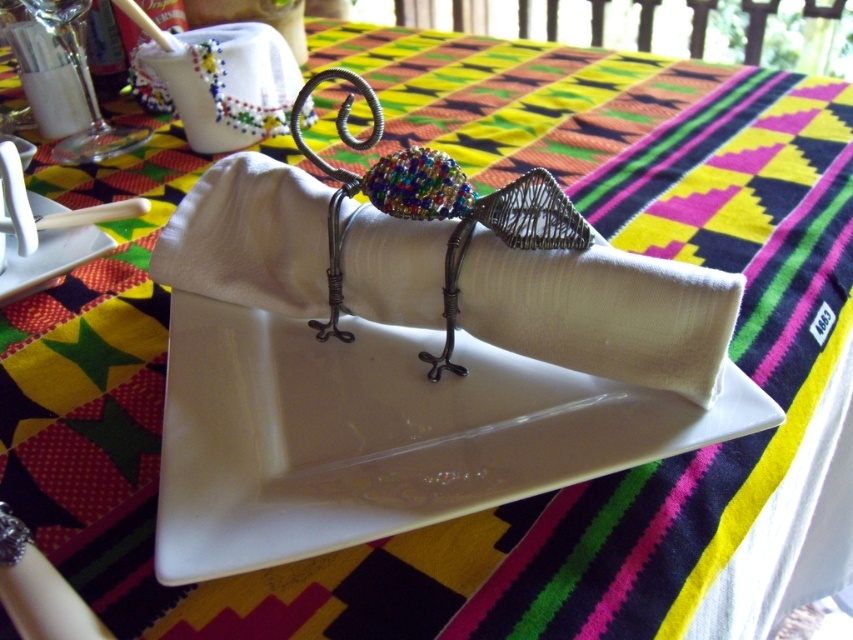
Does white fabric napkin at center appear on the left side of white glossy plate at upper left?

In fact, white fabric napkin at center is to the right of white glossy plate at upper left.

Does white fabric napkin at center have a lesser width compared to white glossy plate at upper left?

No.

Between point (664, 372) and point (30, 266), which one is positioned in front?

Positioned in front is point (664, 372).

Where is `white fabric napkin at center`? The height and width of the screenshot is (640, 853). white fabric napkin at center is located at coordinates (602, 312).